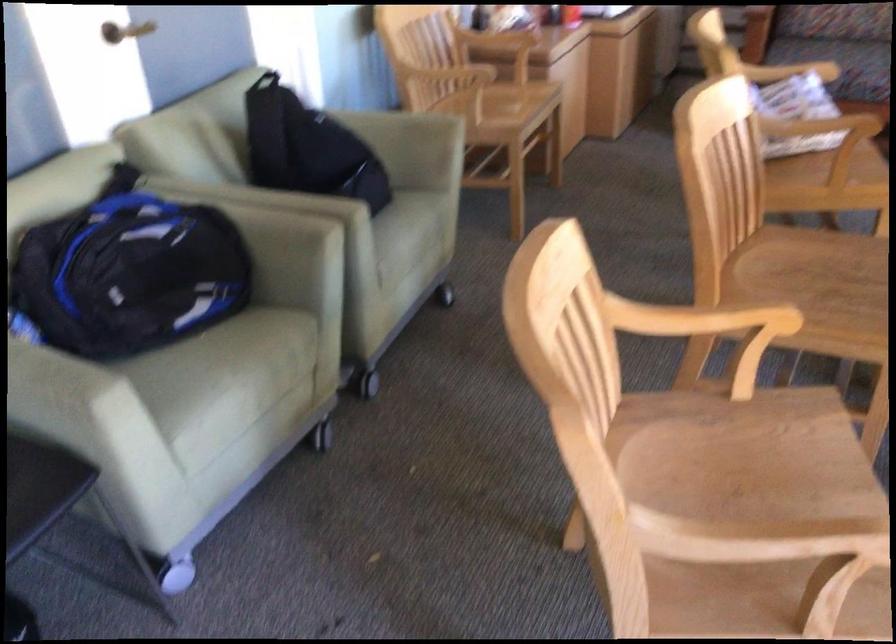
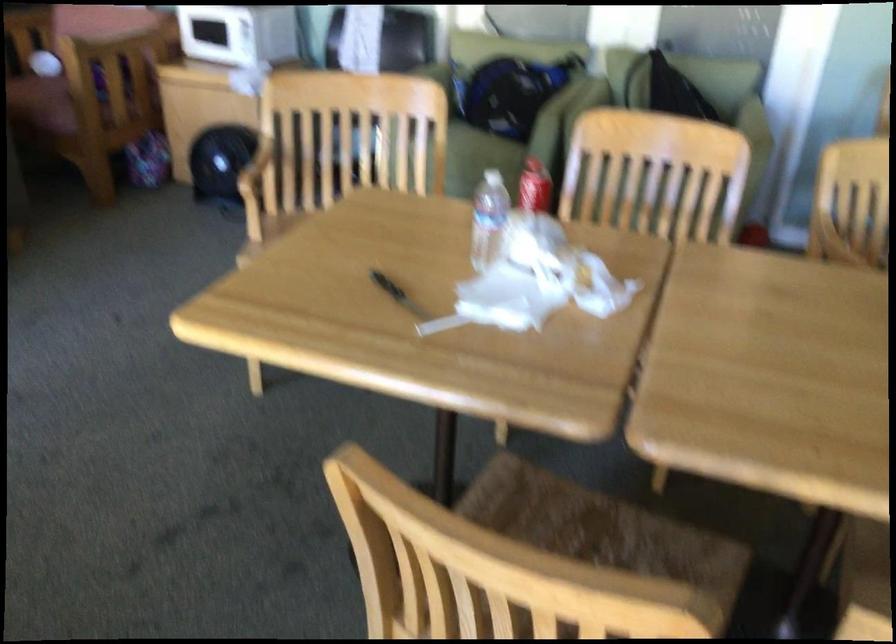
Question: I am providing you with two images of the same scene from different viewpoints. After the viewpoint changes to image2, which objects are now occluded?

Choices:
 (A) black handle knife
 (B) red candle jar
 (C) chair armrest
 (D) chair sitting surface

Answer: (C)